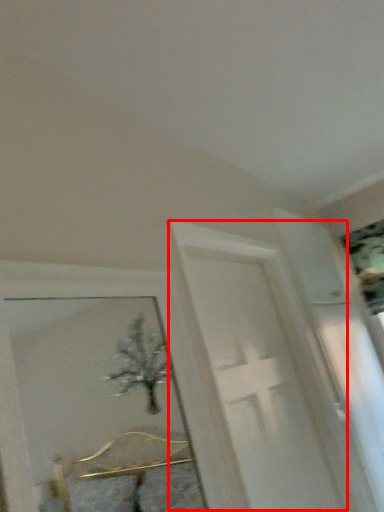
Question: From the image's perspective, considering the relative positions of screen door (annotated by the red box) and picture frame in the image provided, where is screen door (annotated by the red box) located with respect to the staircase?

Choices:
 (A) above
 (B) below

Answer: (B)